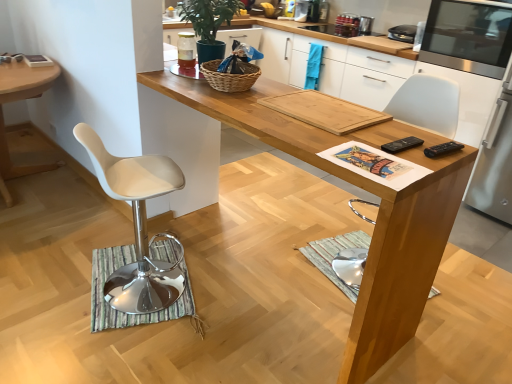
Question: Is white plastic chair at left, the 1th desk from the left, wider or thinner than stainless steel microwave at upper right, the third appliance in the left-to-right sequence?

Choices:
 (A) thin
 (B) wide

Answer: (B)

Question: Considering the positions of white plastic chair at left, the second desk in the right-to-left sequence, and stainless steel microwave at upper right, the third appliance in the left-to-right sequence, in the image, is white plastic chair at left, the second desk in the right-to-left sequence, taller or shorter than stainless steel microwave at upper right, the third appliance in the left-to-right sequence,?

Choices:
 (A) short
 (B) tall

Answer: (B)

Question: Estimate the real-world distances between objects in this image. Which object is closer to the metallic silver toaster at upper center, placed as the third appliance when sorted from right to left?

Choices:
 (A) white plastic chair at left
 (B) stainless steel microwave at upper right, the third appliance in the left-to-right sequence
 (C) stainless steel microwave at right, the 1th appliance when ordered from right to left
 (D) white plastic chair at left, the 1th desk from the left
 (E) woven brown basket at center

Answer: (B)

Question: Estimate the real-world distances between objects in this image. Which object is closer to the white plastic chair at left?

Choices:
 (A) clear glass jar at upper center, the first appliance when ordered from left to right
 (B) wooden cutting board at center
 (C) wooden cutting board at center
 (D) metallic silver toaster at upper center, the 2th appliance from the left
 (E) green matte plant at upper center

Answer: (C)